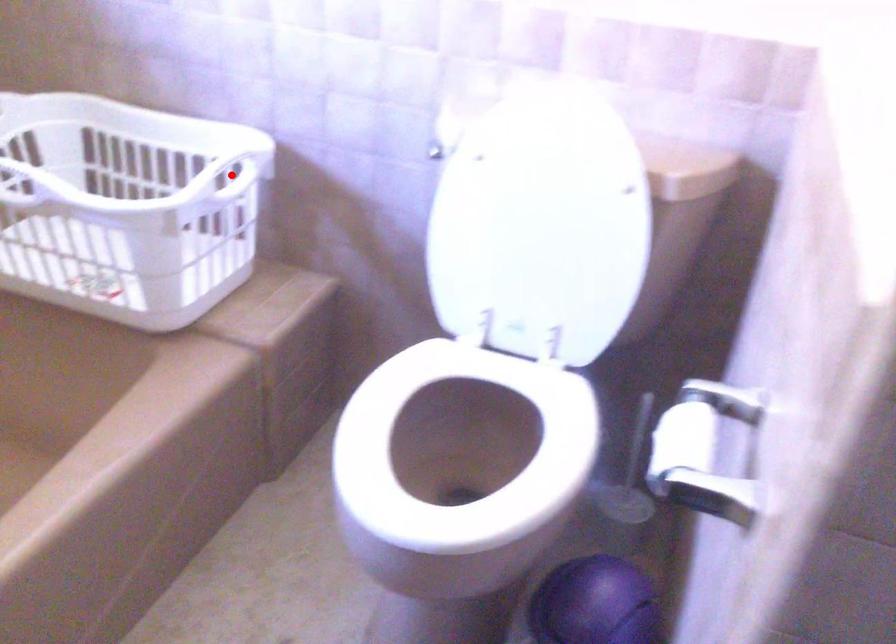
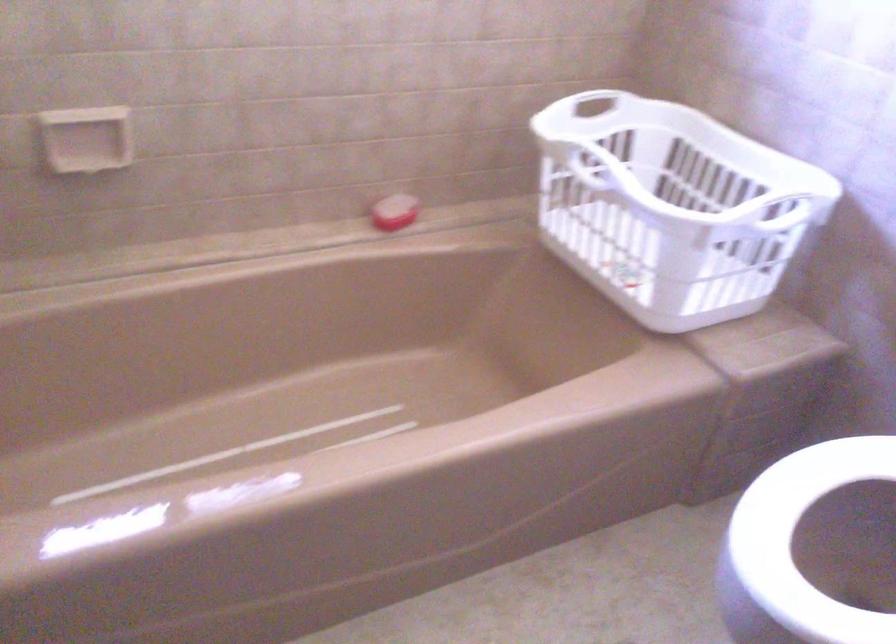
Locate, in the second image, the point that corresponds to the highlighted location in the first image.

(780, 207)